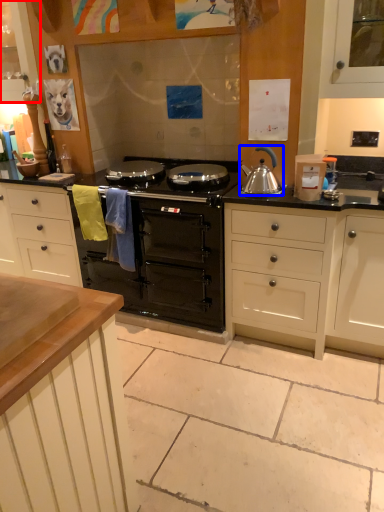
Question: Which object appears farthest to the camera in this image, cabinetry (highlighted by a red box) or kitchen appliance (highlighted by a blue box)?

Choices:
 (A) cabinetry
 (B) kitchen appliance

Answer: (A)